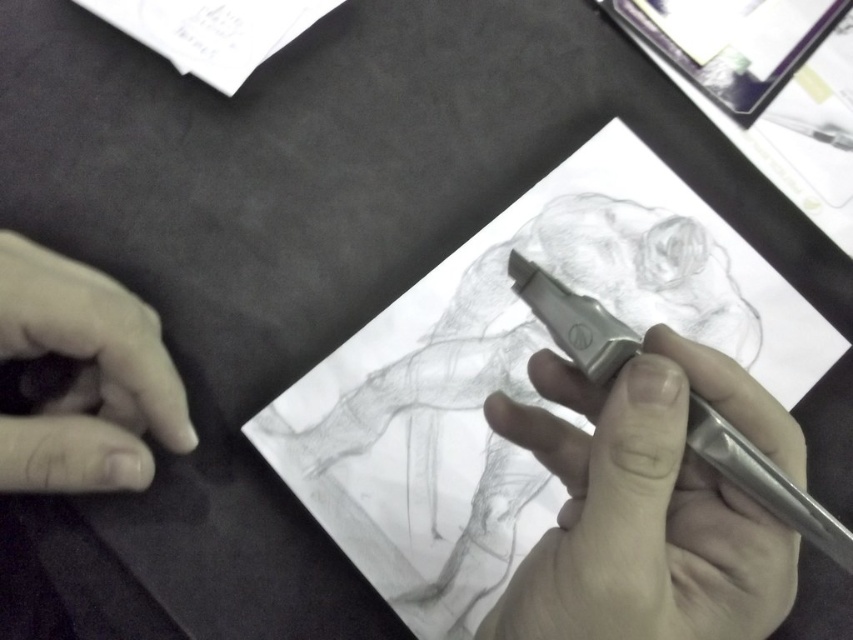
Question: Which object appears farthest from the camera in this image?

Choices:
 (A) smooth skin at lower left
 (B) metallic pen at lower right

Answer: (A)

Question: Among these points, which one is farthest from the camera?

Choices:
 (A) (734, 317)
 (B) (71, 260)

Answer: (A)

Question: Can you confirm if graphite paper at center is thinner than smooth skin at lower left?

Choices:
 (A) no
 (B) yes

Answer: (A)

Question: Is the position of graphite paper at center more distant than that of metallic pen at lower right?

Choices:
 (A) no
 (B) yes

Answer: (B)

Question: Observing the image, what is the correct spatial positioning of metallic pen at lower right in reference to smooth skin at lower left?

Choices:
 (A) below
 (B) above

Answer: (A)

Question: Estimate the real-world distances between objects in this image. Which object is closer to the smooth skin at lower left?

Choices:
 (A) graphite paper at center
 (B) metallic pen at lower right

Answer: (A)